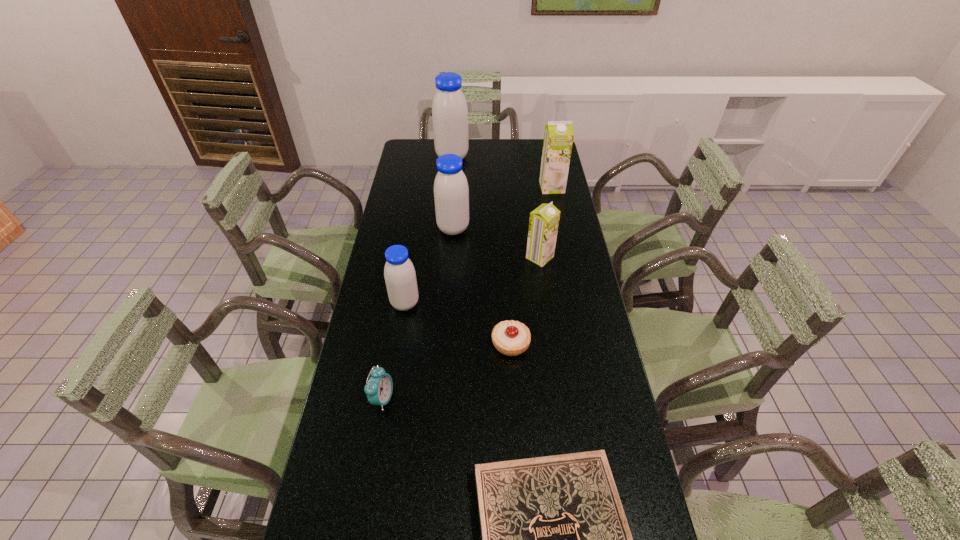
Image resolution: width=960 pixels, height=540 pixels. I want to click on vacant space that is in between the alarm clock and the beige pastry, so click(x=446, y=371).

What are the coordinates of `empty space that is in between the alarm clock and the smaller green soya milk` in the screenshot? It's located at (461, 328).

Where is `free space between the second nearest blue soya milk and the second nearest soya milk`? This screenshot has width=960, height=540. free space between the second nearest blue soya milk and the second nearest soya milk is located at coordinates (496, 243).

At what (x,y) coordinates should I click in order to perform the action: click on empty space that is in between the third farthest soya milk and the third shortest object. Please return your answer as a coordinate pair (x, y). Looking at the image, I should click on (418, 314).

At what (x,y) coordinates should I click in order to perform the action: click on free space between the smallest blue soya milk and the fifth nearest object. Please return your answer as a coordinate pair (x, y). Image resolution: width=960 pixels, height=540 pixels. Looking at the image, I should click on (472, 280).

Identify which object is the fourth closest to the bigger green soya milk. Please provide its 2D coordinates. Your answer should be formatted as a tuple, i.e. [(x, y)], where the tuple contains the x and y coordinates of a point satisfying the conditions above.

[(399, 273)]

Locate an element on the screen. The height and width of the screenshot is (540, 960). the sixth closest object to the tallest soya milk is located at coordinates (379, 388).

Identify which soya milk is the second nearest to the sixth nearest object. Please provide its 2D coordinates. Your answer should be formatted as a tuple, i.e. [(x, y)], where the tuple contains the x and y coordinates of a point satisfying the conditions above.

[(399, 273)]

Identify which soya milk is the fifth closest to the second nearest object. Please provide its 2D coordinates. Your answer should be formatted as a tuple, i.e. [(x, y)], where the tuple contains the x and y coordinates of a point satisfying the conditions above.

[(449, 109)]

Select which blue soya milk appears as the second closest to the second nearest object. Please provide its 2D coordinates. Your answer should be formatted as a tuple, i.e. [(x, y)], where the tuple contains the x and y coordinates of a point satisfying the conditions above.

[(451, 192)]